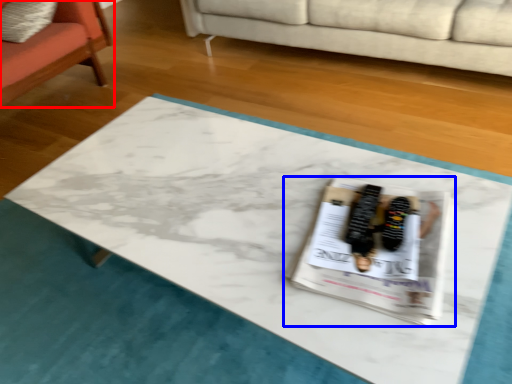
Question: Which of the following is the farthest to the observer, chair (highlighted by a red box) or magazine (highlighted by a blue box)?

Choices:
 (A) chair
 (B) magazine

Answer: (A)